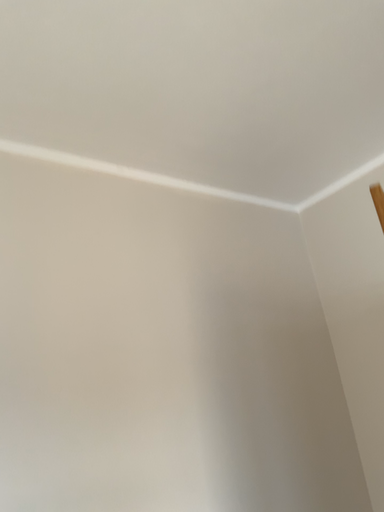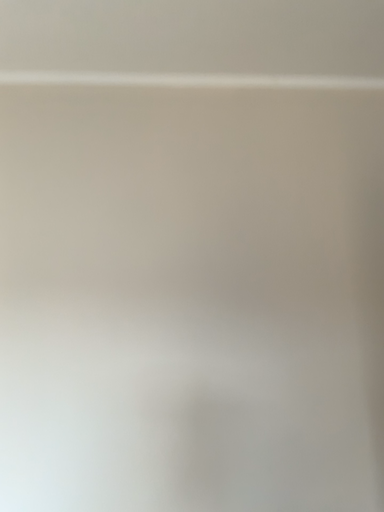
Question: Which way did the camera rotate in the video?

Choices:
 (A) rotated downward
 (B) rotated upward

Answer: (A)